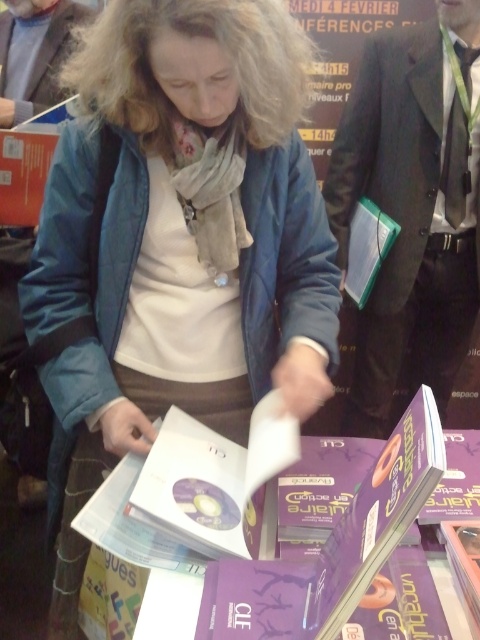
Question: Among these objects, which one is nearest to the camera?

Choices:
 (A) gray wool scarf at upper center
 (B) matte blue jacket at center
 (C) dark gray suit at center

Answer: (B)

Question: Does dark gray suit at center appear over gray wool scarf at upper center?

Choices:
 (A) yes
 (B) no

Answer: (B)

Question: Which point is closer to the camera?

Choices:
 (A) dark gray suit at center
 (B) transparent plastic book at center

Answer: (A)

Question: Is matte blue jacket at center bigger than gray wool scarf at upper center?

Choices:
 (A) no
 (B) yes

Answer: (B)

Question: Which of the following is the closest to the observer?

Choices:
 (A) transparent plastic book at center
 (B) matte blue jacket at center
 (C) gray wool scarf at upper center

Answer: (B)

Question: Is matte blue jacket at center positioned behind transparent plastic book at center?

Choices:
 (A) yes
 (B) no

Answer: (B)